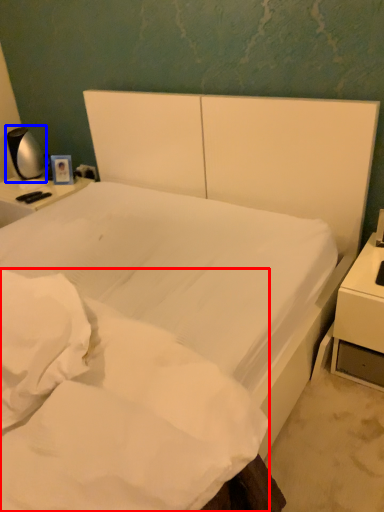
Question: Which object appears farthest to the camera in this image, mattress (highlighted by a red box) or bedside lamp (highlighted by a blue box)?

Choices:
 (A) mattress
 (B) bedside lamp

Answer: (B)